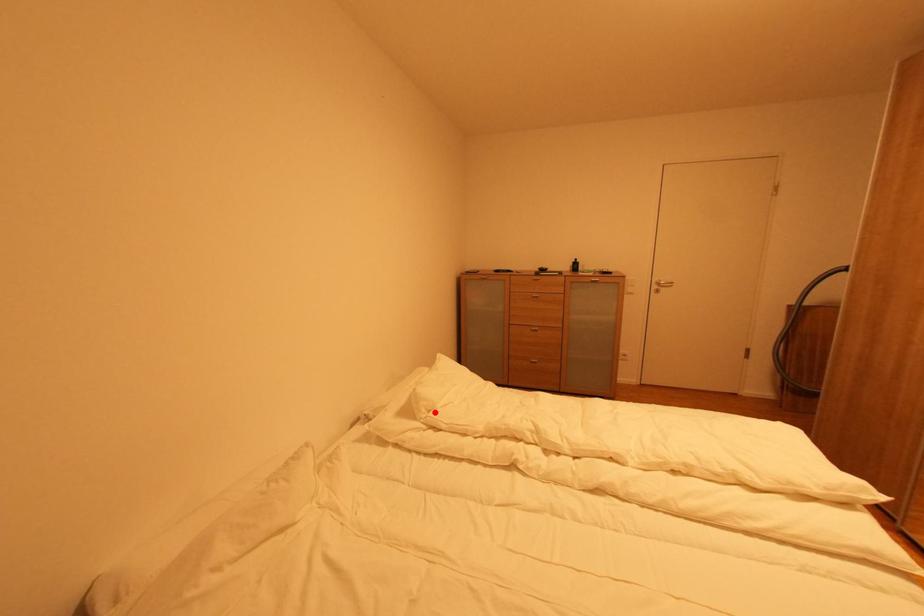
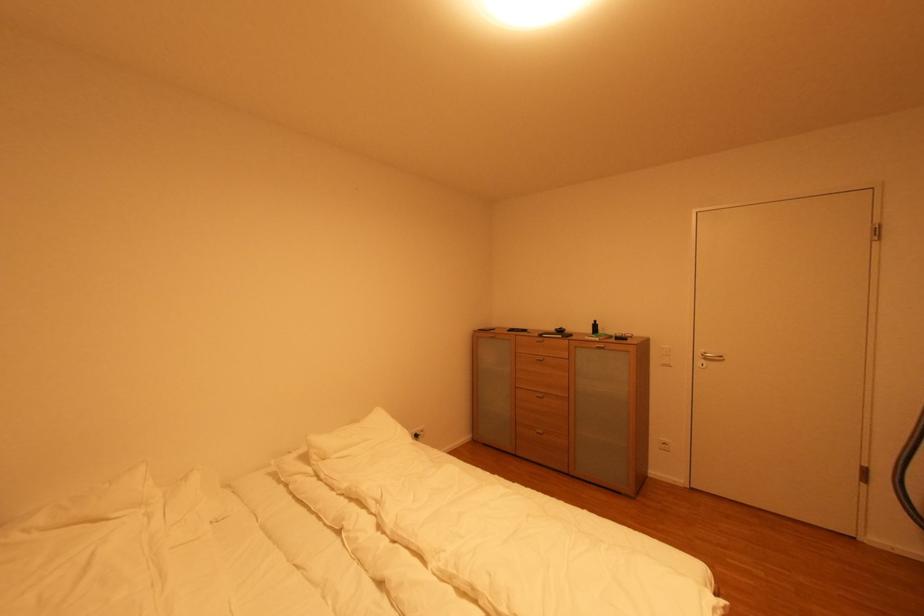
The point at the highlighted location is marked in the first image. Where is the corresponding point in the second image?

(330, 461)